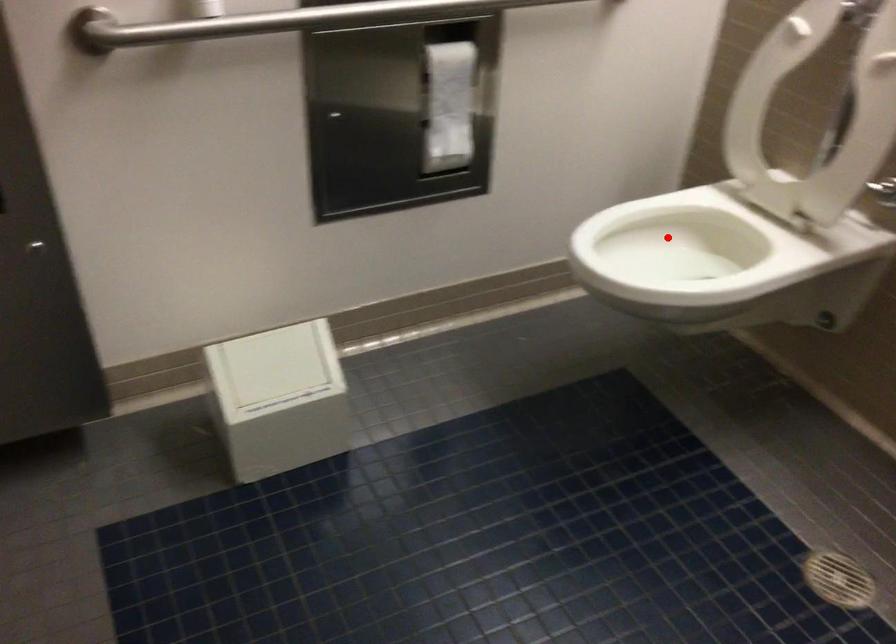
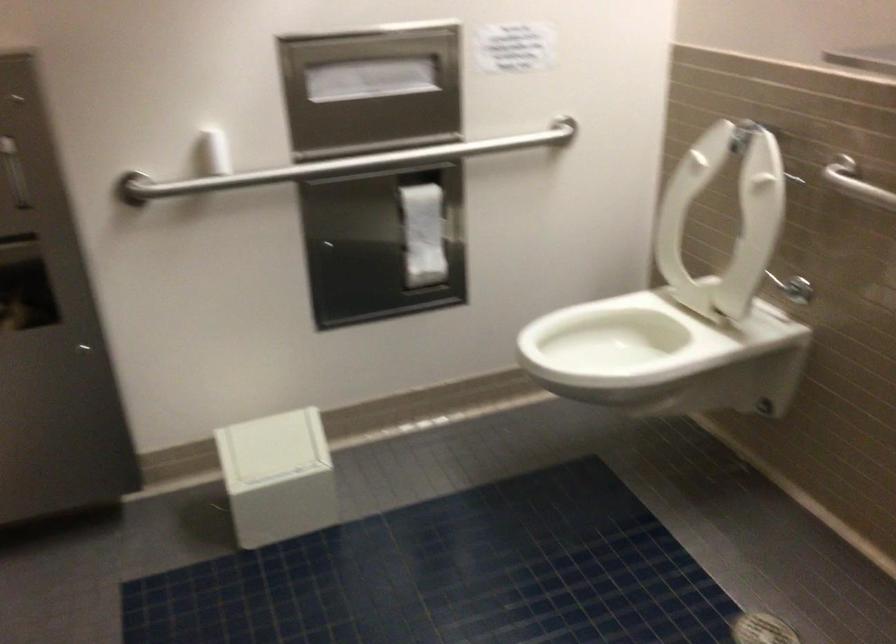
In the second image, find the point that corresponds to the highlighted location in the first image.

(616, 336)